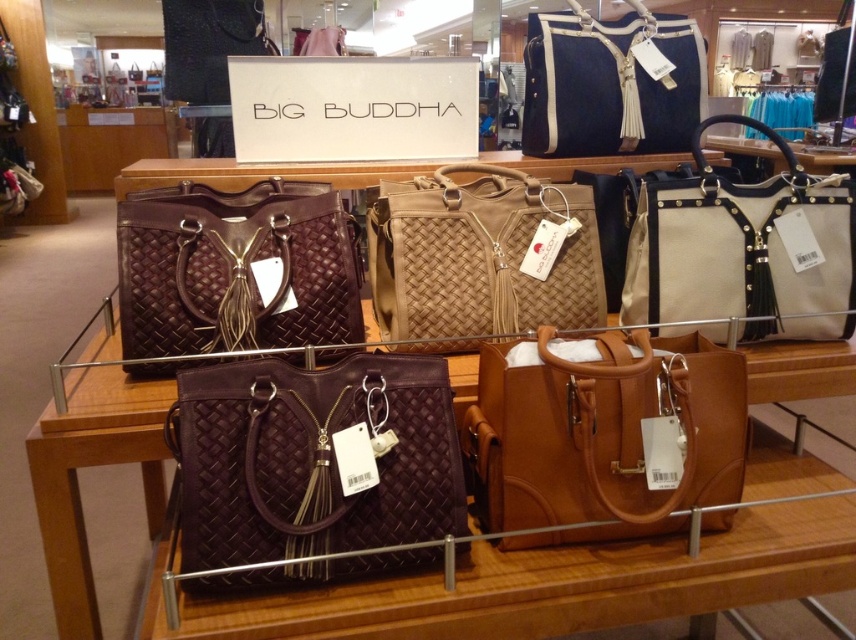
Question: Among these objects, which one is farthest from the camera?

Choices:
 (A) matte woven tote at center
 (B) matte brown leather handbag at center
 (C) tan woven tote at center

Answer: (C)

Question: Which point appears farthest from the camera in this image?

Choices:
 (A) (205, 289)
 (B) (586, 380)
 (C) (660, 116)

Answer: (C)

Question: Observing the image, what is the correct spatial positioning of beige canvas tote at right in reference to tan woven tote at center?

Choices:
 (A) below
 (B) above

Answer: (A)

Question: Is matte woven tote at center above beige canvas tote at right?

Choices:
 (A) yes
 (B) no

Answer: (B)

Question: Can you confirm if matte brown leather handbag at center is smaller than beige canvas tote at right?

Choices:
 (A) yes
 (B) no

Answer: (A)

Question: Estimate the real-world distances between objects in this image. Which object is closer to the matte woven tote at center?

Choices:
 (A) beige canvas tote at right
 (B) tan woven tote at center

Answer: (B)